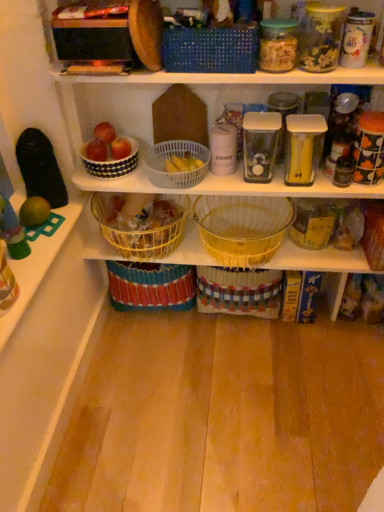
This screenshot has width=384, height=512. I want to click on free location to the left of woven straw basket at lower right, positioned as the fifth basket in left-to-right order, so click(x=337, y=260).